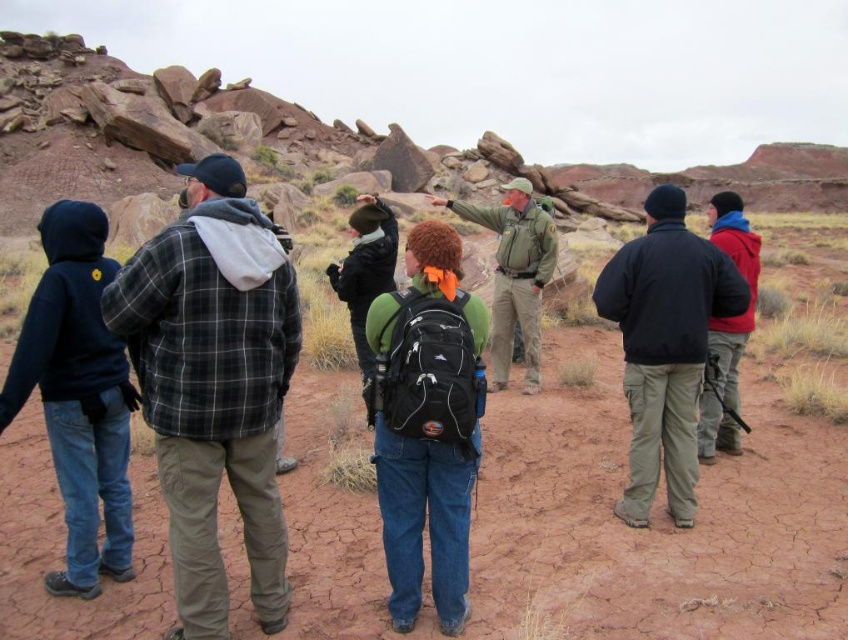
You are a photographer planning to take a group photo of the red fleece jacket at center and the matte black backpack at center. Which object should you focus on first if you want to ensure both are in the frame without moving the camera? Explain your reasoning based on their sizes.

The red fleece jacket at center is bigger than the matte black backpack at center. Since the red fleece jacket at center takes up more space, you should focus on it first to ensure it fits within the camera frame, then adjust to include the smaller matte black backpack at center without moving the camera.